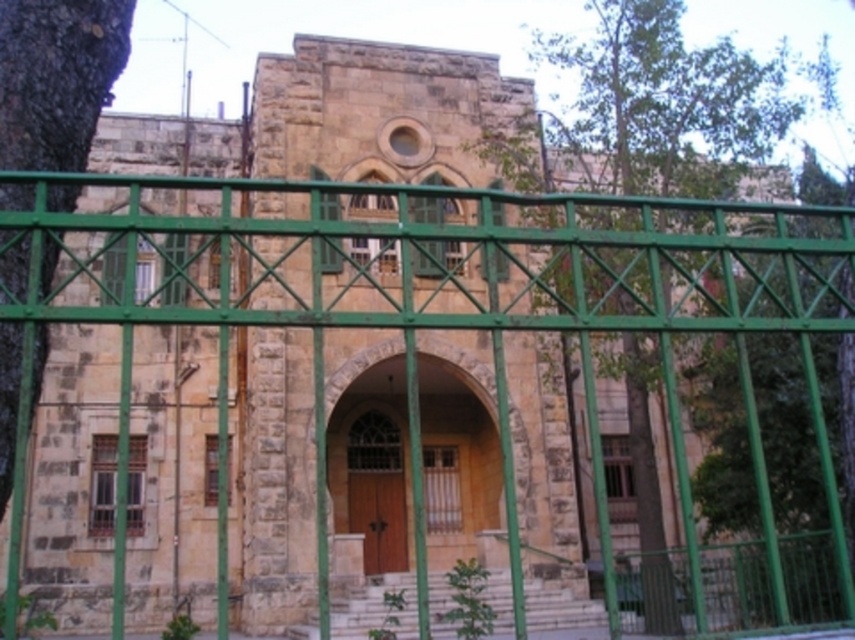
Is green leafy tree at center shorter than dark green bark tree at left?

In fact, green leafy tree at center may be taller than dark green bark tree at left.

Who is more forward, (814, 394) or (40, 99)?

Point (814, 394)

You are a GUI agent. You are given a task and a screenshot of the screen. Output one action in this format:
    pyautogui.click(x=<x>, y=<y>)
    Task: Click on the green leafy tree at center
    The height and width of the screenshot is (640, 855).
    Given the screenshot: What is the action you would take?
    [x=708, y=330]

In the scene shown: Can you confirm if green metal fence at center is shorter than green leafy tree at center?

Indeed, green metal fence at center has a lesser height compared to green leafy tree at center.

Which is in front, point (32, 310) or point (794, 282)?

Point (32, 310) is in front.

Does point (302, 321) come in front of point (624, 248)?

Yes, point (302, 321) is closer to viewer.

Find the location of a particular element. green metal fence at center is located at coordinates (438, 321).

Is green metal fence at center to the left of wooden door at center from the viewer's perspective?

In fact, green metal fence at center is to the right of wooden door at center.

Does green metal fence at center have a larger size compared to wooden door at center?

Yes.

What do you see at coordinates (438, 321) in the screenshot?
I see `green metal fence at center` at bounding box center [438, 321].

Where is `green metal fence at center`? The width and height of the screenshot is (855, 640). green metal fence at center is located at coordinates (438, 321).